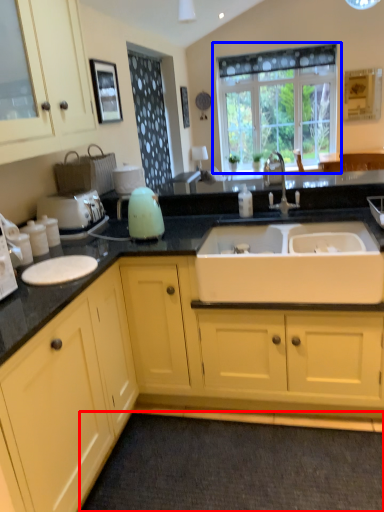
Question: Which point is further to the camera, plain (highlighted by a red box) or window (highlighted by a blue box)?

Choices:
 (A) plain
 (B) window

Answer: (B)